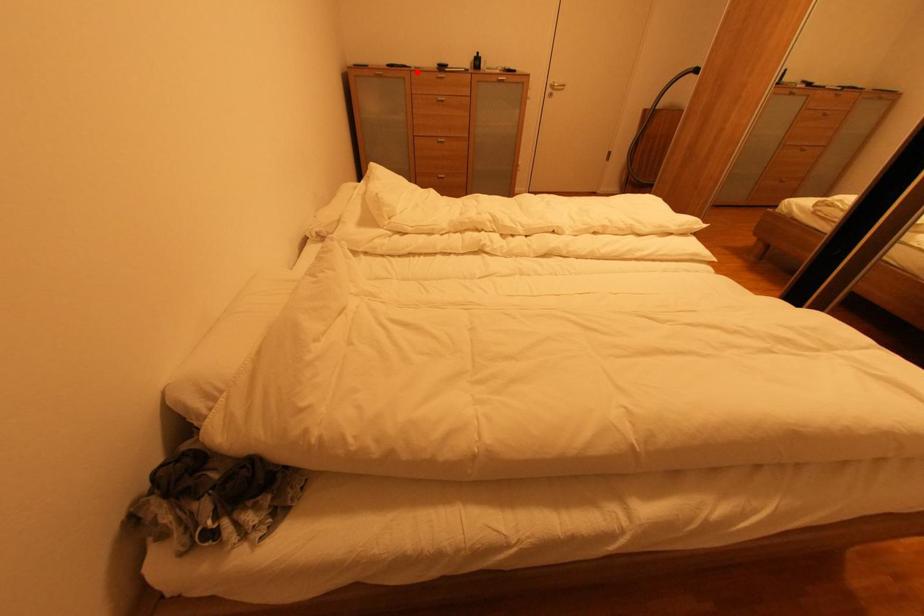
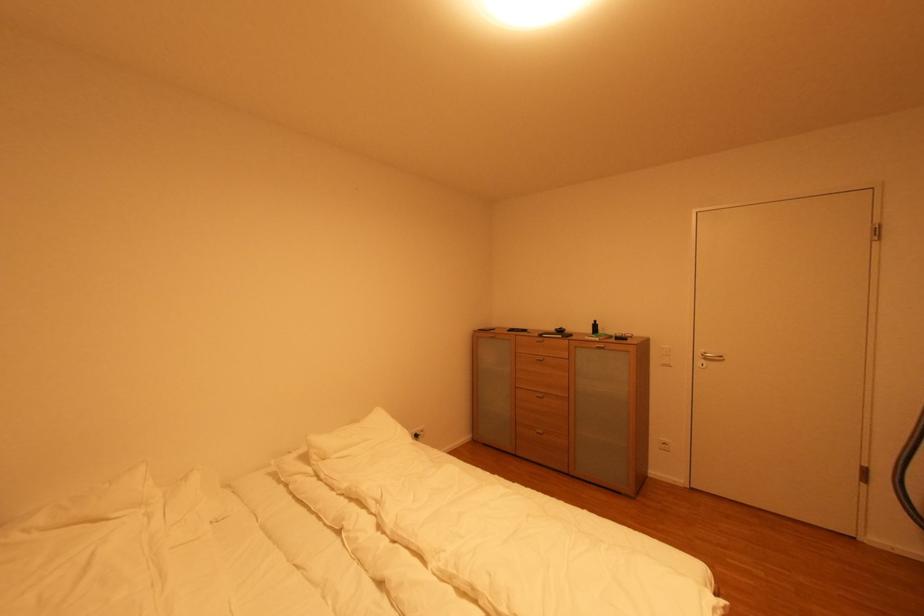
The point at the highlighted location is marked in the first image. Where is the corresponding point in the second image?

(521, 336)